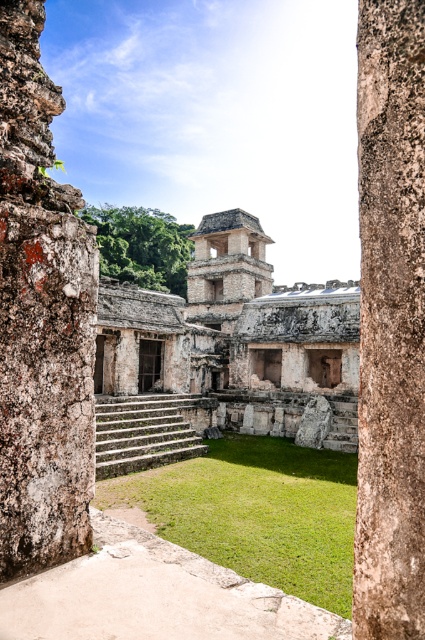
You are standing in front of the ancient structure and want to determine which of the two points, point (8, 483) or point (402, 355), is closer to you. Based on the scene description, which point is nearer?

Point (8, 483) is closer to you because it is further to the viewer than point (402, 355).

You are standing at the camera position and want to reach the point marked at coordinates (243,424). Given that the maximum distance you can walk is 180 feet, will you be able to reach it?

The point marked at coordinates (243,424) is 179.71 feet away from your current position. Since this distance is within your maximum walking limit of 180 feet, you will be able to reach it.

You are an archaeologist planning to set up a 20 feet long protective barrier between the rusty stone pillar at left and the rough stone pillar at center. Based on the scene description, will the barrier fit perfectly between them without overlapping either pillar?

The distance between the rusty stone pillar at left and the rough stone pillar at center is 21.61 feet. Since the barrier is 20 feet long, it will fit with 1.61 feet of space remaining between the pillars.